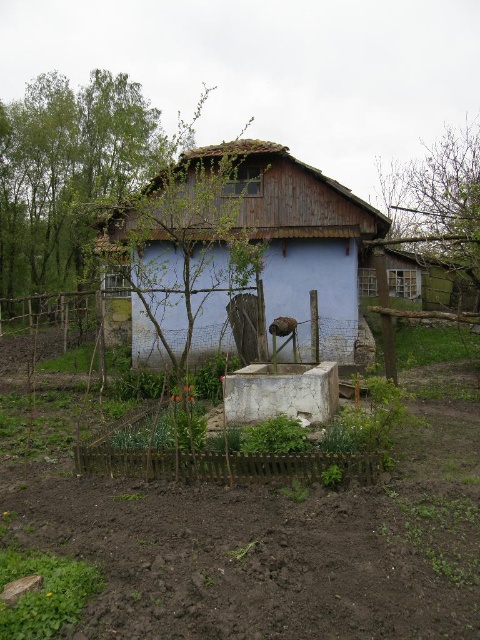
Does wooden hut at center have a lesser height compared to brown wooden fence at lower center?

No, wooden hut at center is not shorter than brown wooden fence at lower center.

Locate an element on the screen. wooden hut at center is located at coordinates (239, 252).

Does brown soil at center have a smaller size compared to wooden hut at center?

Yes, brown soil at center is smaller than wooden hut at center.

Locate an element on the screen. The image size is (480, 640). brown soil at center is located at coordinates (278, 541).

Does brown soil at center have a larger size compared to brown wooden fence at lower center?

Actually, brown soil at center might be smaller than brown wooden fence at lower center.

Is point (170, 547) farther from camera compared to point (255, 468)?

No, it is in front of (255, 468).

Does point (45, 540) lie behind point (200, 467)?

No.

Find the location of a particular element. brown soil at center is located at coordinates (278, 541).